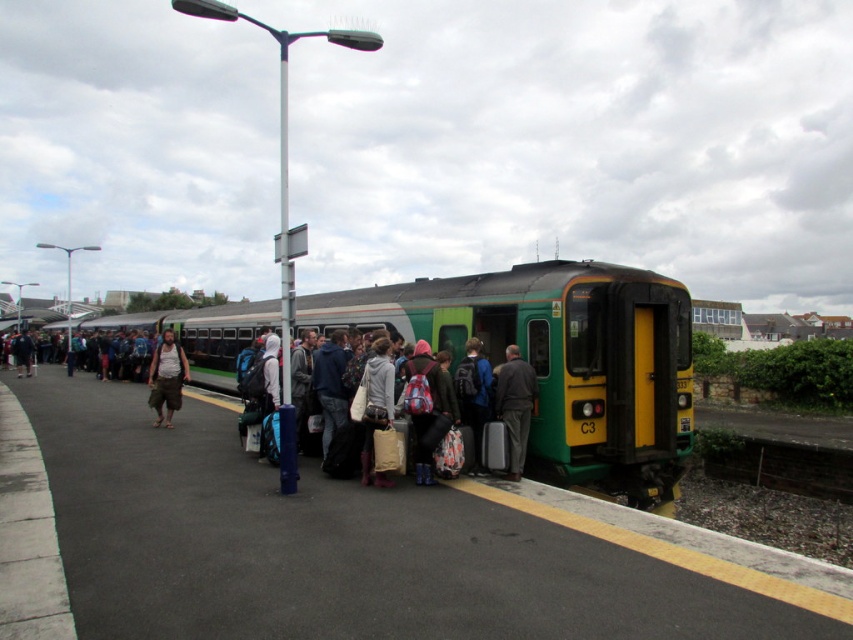
Question: Which object is the farthest from the green/yellow painted metal train at center?

Choices:
 (A) brown cotton shorts at center
 (B) green/yellow plastic train at center

Answer: (B)

Question: Is green/yellow plastic train at center smaller than brown cotton shorts at center?

Choices:
 (A) no
 (B) yes

Answer: (B)

Question: Which of the following is the closest to the observer?

Choices:
 (A) green/yellow painted metal train at center
 (B) green/yellow plastic train at center

Answer: (B)

Question: Can you confirm if green/yellow painted metal train at center is positioned above brown cotton shorts at center?

Choices:
 (A) yes
 (B) no

Answer: (A)

Question: Is the position of green/yellow plastic train at center more distant than that of green/yellow painted metal train at center?

Choices:
 (A) yes
 (B) no

Answer: (B)

Question: Which of the following is the farthest from the observer?

Choices:
 (A) green/yellow plastic train at center
 (B) green/yellow painted metal train at center

Answer: (B)